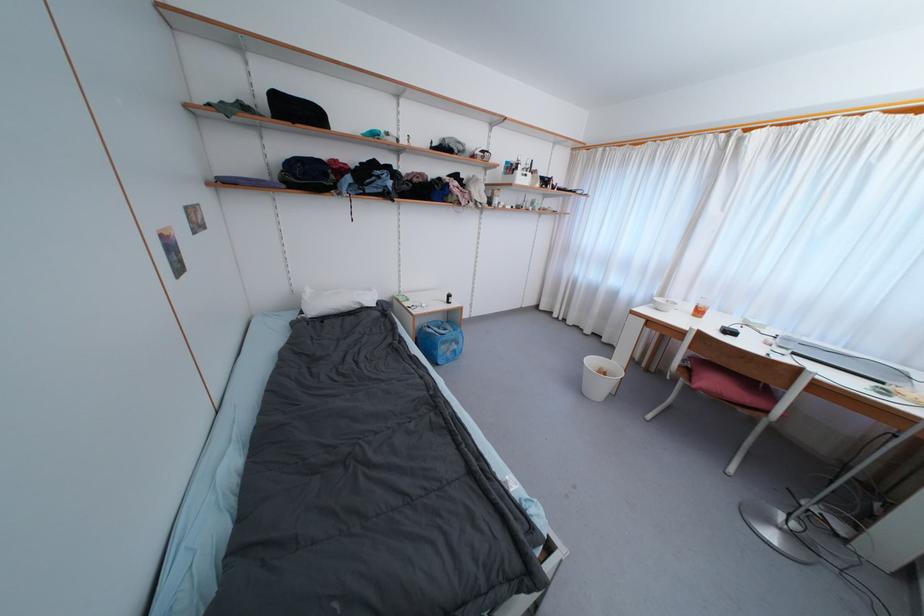
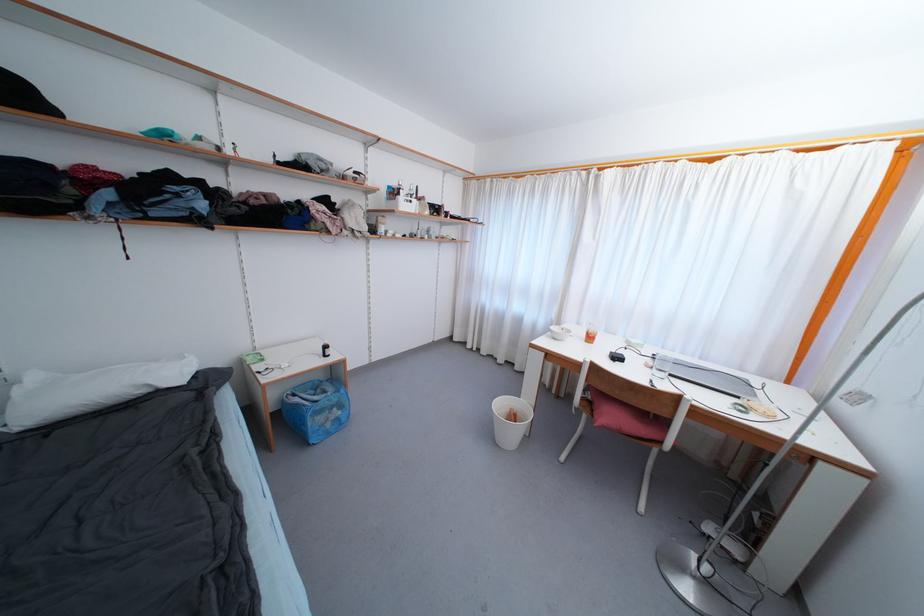
In the second image, find the point that corresponds to point 454,299 in the first image.

(330, 350)